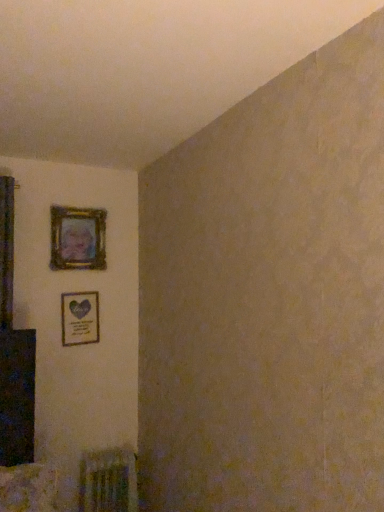
Question: Based on their sizes in the image, would you say wooden frame at upper left, which appears as the second picture frame when ordered from the bottom, is bigger or smaller than metallic silver radiator at lower left?

Choices:
 (A) small
 (B) big

Answer: (A)

Question: Is wooden frame at upper left, which ranks as the 1th picture frame in top-to-bottom order, spatially inside metallic silver radiator at lower left, or outside of it?

Choices:
 (A) outside
 (B) inside

Answer: (A)

Question: Which object is the closest to the metallic silver radiator at lower left?

Choices:
 (A) wooden frame at upper left, which ranks as the 1th picture frame in top-to-bottom order
 (B) matte gold picture frame at upper left, placed as the 2th picture frame when sorted from top to bottom

Answer: (B)

Question: Considering the real-world distances, which object is closest to the matte gold picture frame at upper left, arranged as the first picture frame when ordered from the bottom?

Choices:
 (A) wooden frame at upper left, which appears as the second picture frame when ordered from the bottom
 (B) metallic silver radiator at lower left

Answer: (A)